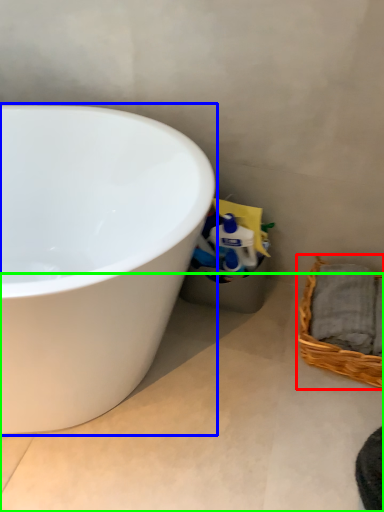
Question: Which is nearer to the picnic basket (highlighted by a red box)? bathtub (highlighted by a blue box) or concrete (highlighted by a green box).

Choices:
 (A) bathtub
 (B) concrete

Answer: (B)